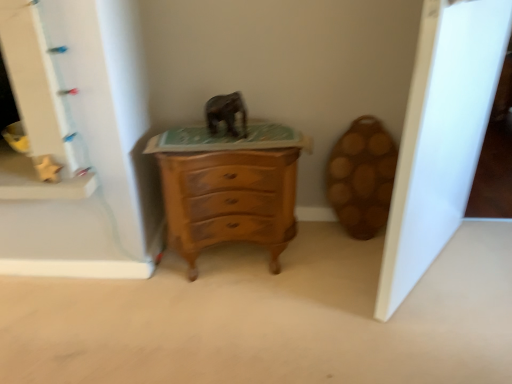
Question: Is wooden chest of drawers at center taller than matte gray elephant at center?

Choices:
 (A) no
 (B) yes

Answer: (B)

Question: Does wooden chest of drawers at center have a smaller size compared to matte gray elephant at center?

Choices:
 (A) no
 (B) yes

Answer: (A)

Question: Is wooden chest of drawers at center to the right of matte gray elephant at center from the viewer's perspective?

Choices:
 (A) no
 (B) yes

Answer: (B)

Question: Is the position of wooden chest of drawers at center more distant than that of matte gray elephant at center?

Choices:
 (A) no
 (B) yes

Answer: (A)

Question: Does wooden chest of drawers at center turn towards matte gray elephant at center?

Choices:
 (A) yes
 (B) no

Answer: (B)

Question: Is white glossy door at right inside or outside of wooden chest of drawers at center?

Choices:
 (A) inside
 (B) outside

Answer: (B)

Question: Is point (476, 147) positioned closer to the camera than point (181, 168)?

Choices:
 (A) closer
 (B) farther

Answer: (B)

Question: Based on their positions, is white glossy door at right located to the left or right of wooden chest of drawers at center?

Choices:
 (A) left
 (B) right

Answer: (B)

Question: From a real-world perspective, is white glossy door at right above or below wooden chest of drawers at center?

Choices:
 (A) below
 (B) above

Answer: (B)

Question: Relative to white glossy door at right, is matte gray elephant at center in front or behind?

Choices:
 (A) front
 (B) behind

Answer: (B)

Question: Does point (209, 127) appear closer or farther from the camera than point (433, 185)?

Choices:
 (A) closer
 (B) farther

Answer: (B)

Question: In terms of height, does matte gray elephant at center look taller or shorter compared to white glossy door at right?

Choices:
 (A) short
 (B) tall

Answer: (A)

Question: Considering the positions of matte gray elephant at center and white glossy door at right in the image, is matte gray elephant at center bigger or smaller than white glossy door at right?

Choices:
 (A) small
 (B) big

Answer: (A)

Question: Is white glossy door at right inside or outside of matte gray elephant at center?

Choices:
 (A) outside
 (B) inside

Answer: (A)

Question: Considering the relative positions of white glossy door at right and matte gray elephant at center in the image provided, is white glossy door at right to the left or to the right of matte gray elephant at center?

Choices:
 (A) right
 (B) left

Answer: (A)